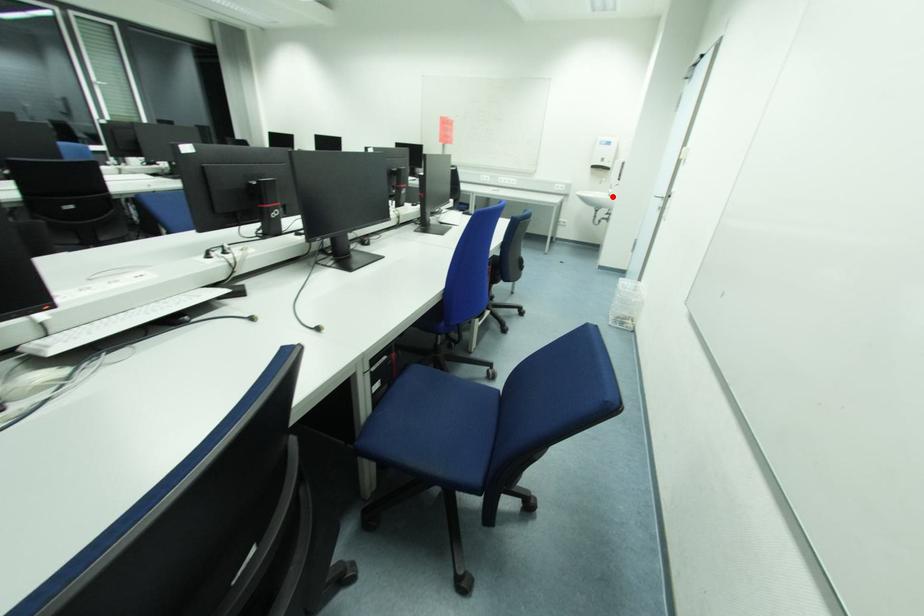
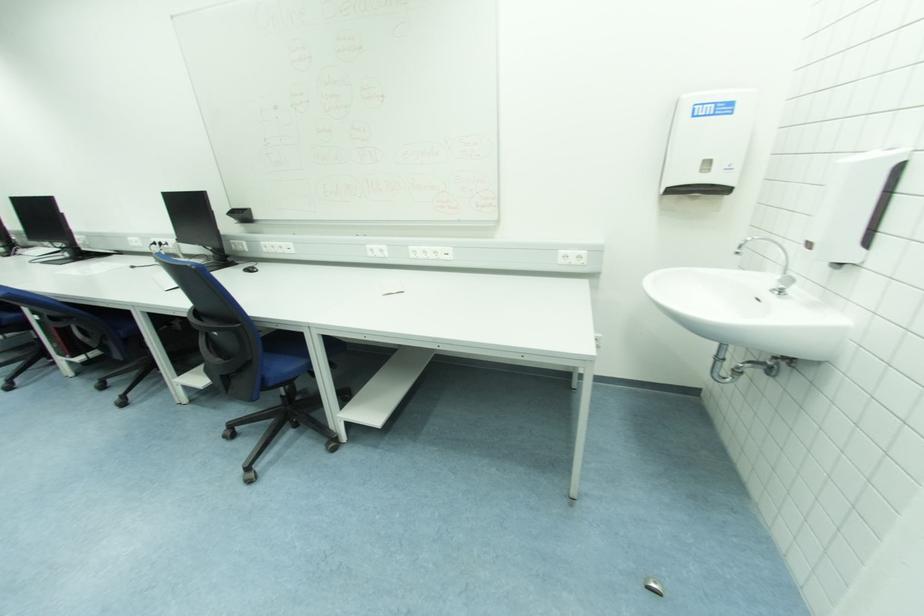
The point at the highlighted location is marked in the first image. Where is the corresponding point in the second image?

(783, 293)